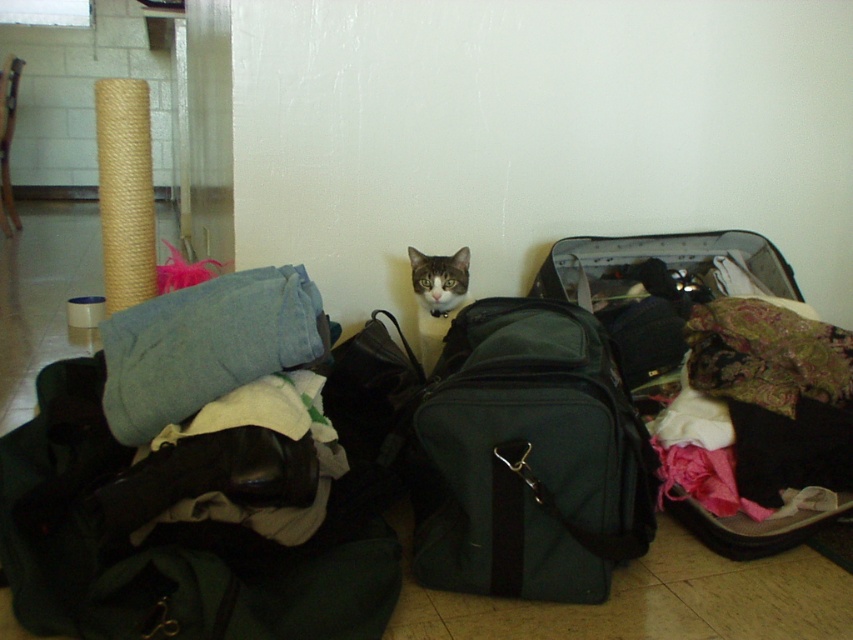
Question: Does denim fabric at center have a lesser width compared to translucent plastic suitcase at center?

Choices:
 (A) yes
 (B) no

Answer: (A)

Question: Which point is farther to the camera?

Choices:
 (A) (126, 204)
 (B) (720, 236)

Answer: (B)

Question: Which of the following is the closest to the observer?

Choices:
 (A) denim fabric at center
 (B) sisal rope scratching post at upper left
 (C) tabby fur cat at center
 (D) translucent plastic suitcase at center

Answer: (A)

Question: Is matte black backpack at center wider than tabby fur cat at center?

Choices:
 (A) yes
 (B) no

Answer: (A)

Question: Which object is farther from the camera taking this photo?

Choices:
 (A) denim fabric at center
 (B) matte black backpack at center

Answer: (A)

Question: Is matte black backpack at center bigger than denim fabric at center?

Choices:
 (A) yes
 (B) no

Answer: (A)